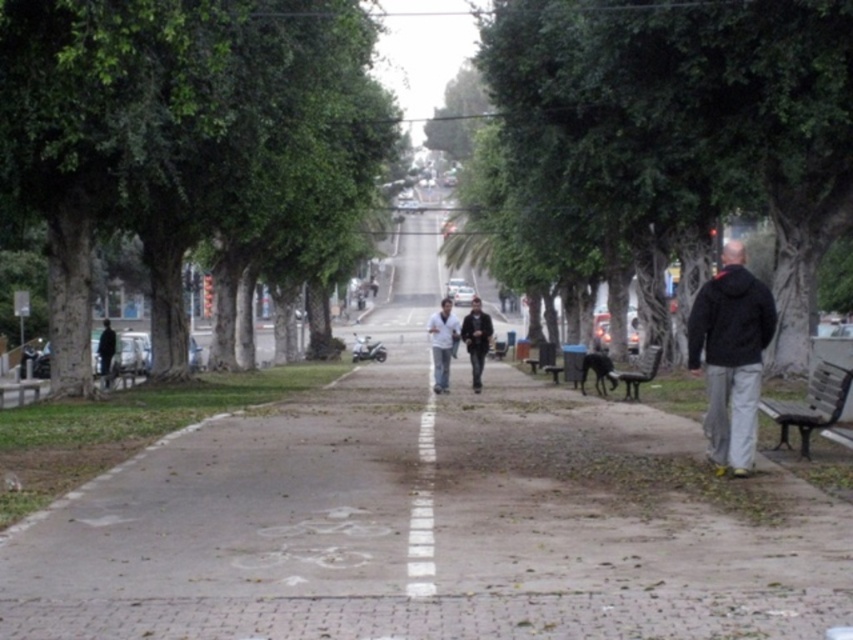
Question: Can you confirm if black matte jacket at lower right is positioned below wooden bench at right?

Choices:
 (A) yes
 (B) no

Answer: (B)

Question: Which of the following is the closest to the observer?

Choices:
 (A) (442, 378)
 (B) (218, 276)
 (C) (422, 554)
 (D) (656, 362)

Answer: (C)

Question: Estimate the real-world distances between objects in this image. Which object is closer to the wooden bench at right?

Choices:
 (A) green leafy tree at left
 (B) dark gray jacket at center

Answer: (B)

Question: Which point appears closest to the camera in this image?

Choices:
 (A) 421,422
 (B) 466,333
 (C) 646,362

Answer: (A)

Question: Can you confirm if black matte jacket at lower right is positioned to the left of dark gray jacket at center?

Choices:
 (A) yes
 (B) no

Answer: (B)

Question: Does green leafy tree at center lie behind dark gray jacket at center?

Choices:
 (A) no
 (B) yes

Answer: (A)